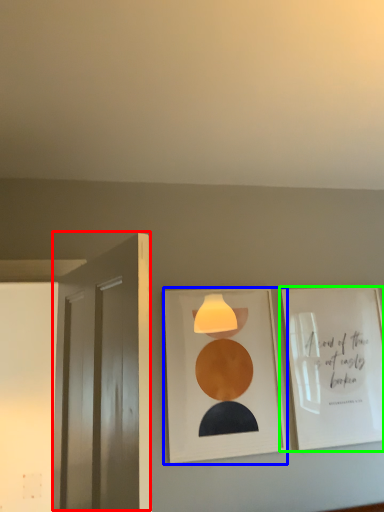
Question: Estimate the real-world distances between objects in this image. Which object is farther from door (highlighted by a red box), picture frame (highlighted by a blue box) or picture frame (highlighted by a green box)?

Choices:
 (A) picture frame
 (B) picture frame

Answer: (B)